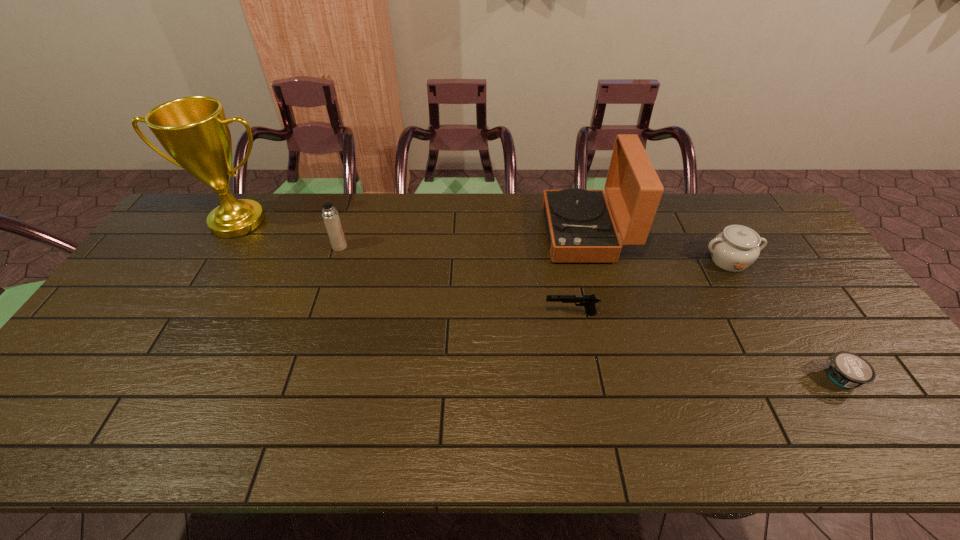
Identify the location of the leftmost object. (194, 131).

Locate an element on the screen. This screenshot has height=540, width=960. the tallest object is located at coordinates tap(194, 131).

Find the location of a particular element. This screenshot has height=540, width=960. the second tallest object is located at coordinates (579, 224).

You are a GUI agent. You are given a task and a screenshot of the screen. Output one action in this format:
    pyautogui.click(x=<x>, y=<y>)
    Task: Click on the second object from left to right
    This screenshot has height=540, width=960.
    Given the screenshot: What is the action you would take?
    pyautogui.click(x=330, y=215)

The height and width of the screenshot is (540, 960). What are the coordinates of `thermos bottle` in the screenshot? It's located at (330, 215).

You are a GUI agent. You are given a task and a screenshot of the screen. Output one action in this format:
    pyautogui.click(x=<x>, y=<y>)
    Task: Click on the fourth tallest object
    
    Given the screenshot: What is the action you would take?
    pyautogui.click(x=737, y=247)

At what (x,y) coordinates should I click in order to perform the action: click on the fifth farthest object. Please return your answer as a coordinate pair (x, y). Looking at the image, I should click on (588, 301).

Locate an element on the screen. The height and width of the screenshot is (540, 960). the fifth tallest object is located at coordinates (588, 301).

In order to click on the shortest object in this screenshot , I will do `click(846, 369)`.

Where is `the nearest object`? The height and width of the screenshot is (540, 960). the nearest object is located at coordinates (846, 369).